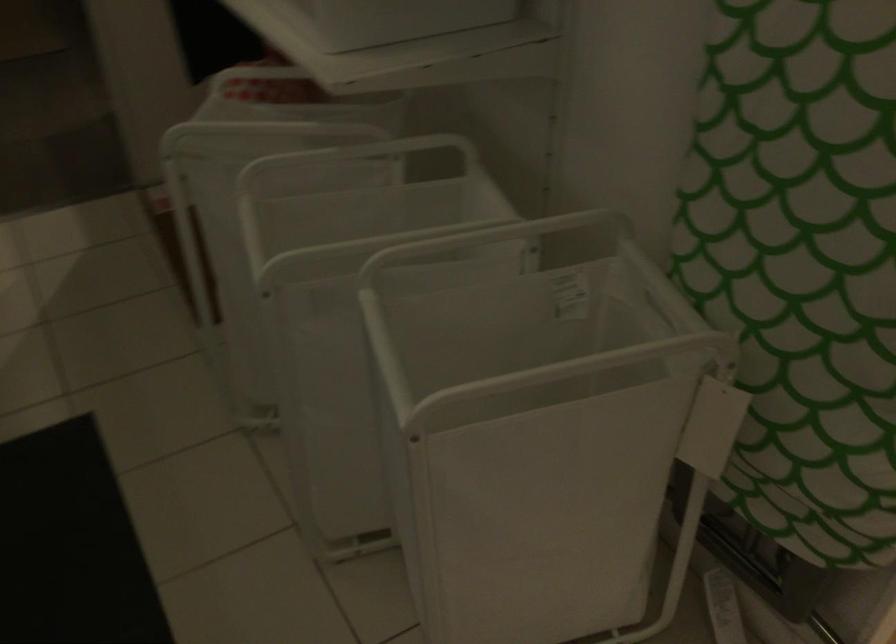
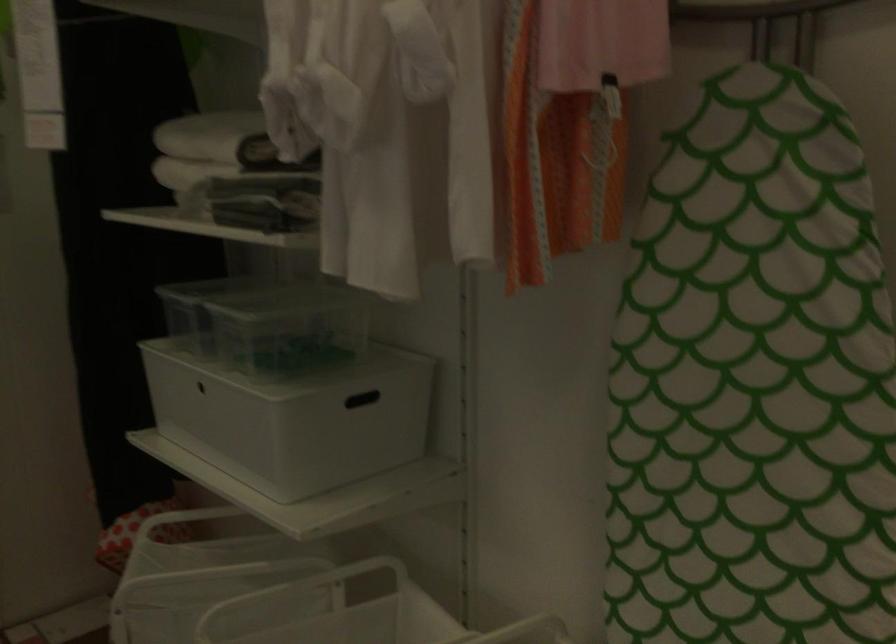
The point at (x=366, y=178) is marked in the first image. Where is the corresponding point in the second image?

(309, 611)